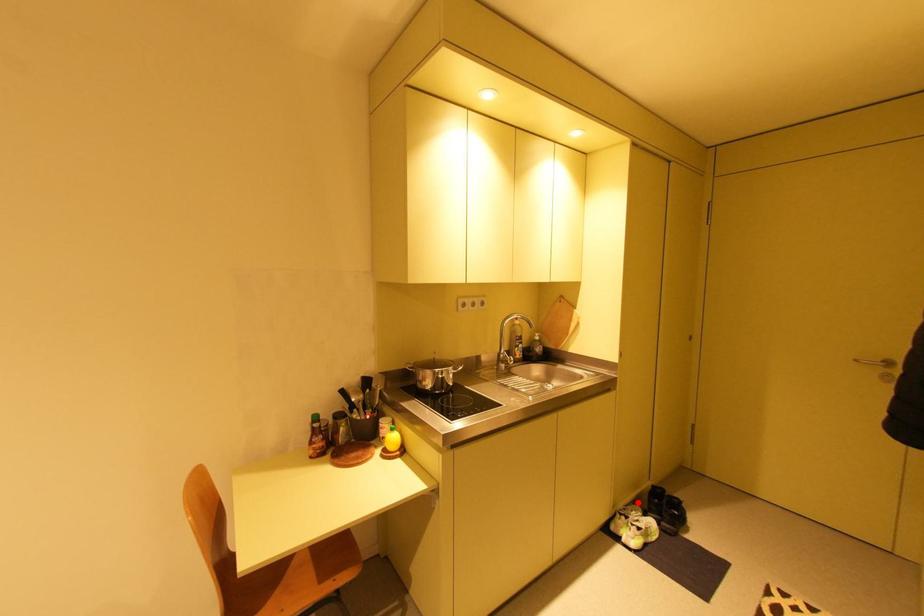
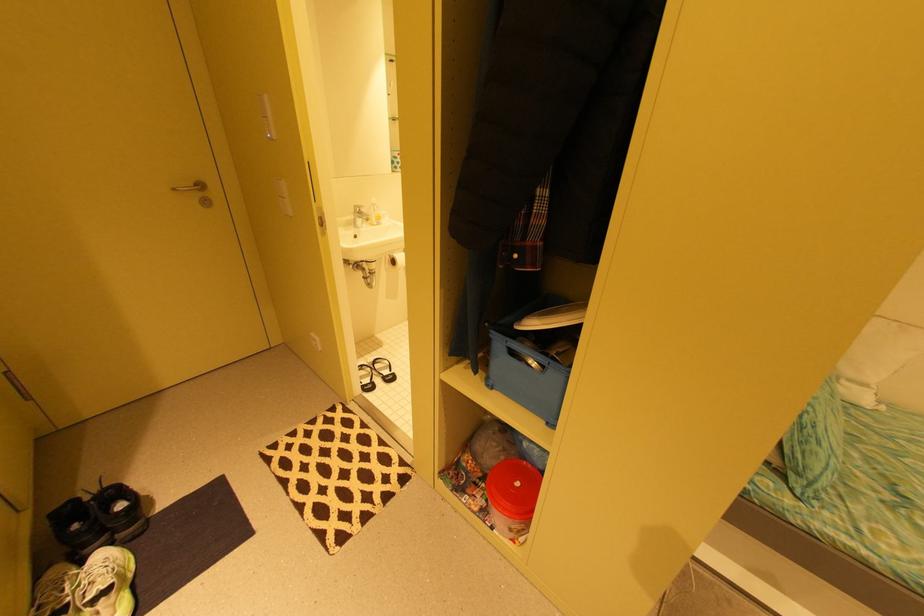
Question: I am providing you with two images of the same scene from different viewpoints. In image1, a red point is highlighted. Considering the same 3D point in image2, which of the following is correct?

Choices:
 (A) It is closer
 (B) It is farther

Answer: (B)